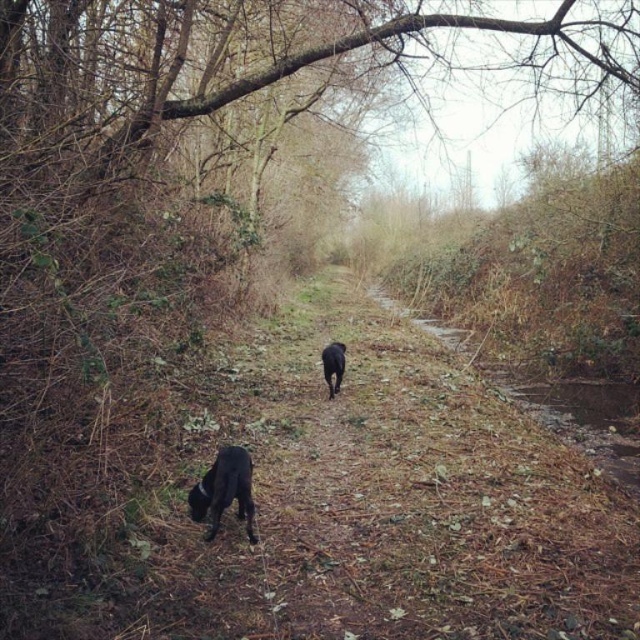
You are a hiker who wants to follow the path in the image. You see the black matte dog at lower left and the black matte dog at center. Which dog is closer to the start of the path?

The black matte dog at lower left is closer to the start of the path because it is positioned below the black matte dog at center, indicating it is further along the path.

You are a hiker who wants to take a photo of both black matte dog at lower left and black matte dog at center. Since the path is narrow, you need to position yourself in a way that both dogs are visible in your camera frame. Based on their positions, which side of the path should you stand on to ensure both dogs are in the shot?

You should stand on the right side of the path because the black matte dog at lower left is to the left of the black matte dog at center, so positioning yourself to the right would allow you to capture both dogs within the frame.